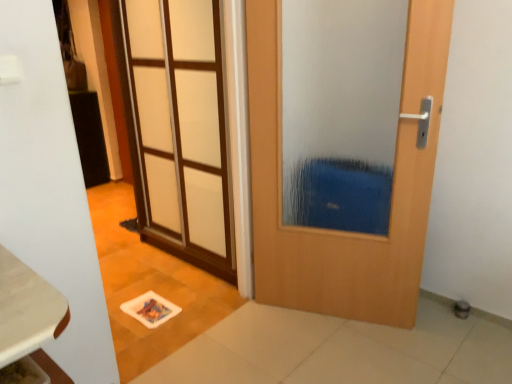
Image resolution: width=512 pixels, height=384 pixels. Identify the location of free region under wooden door at center, which is counted as the first door, starting from the right (from a real-world perspective). (329, 316).